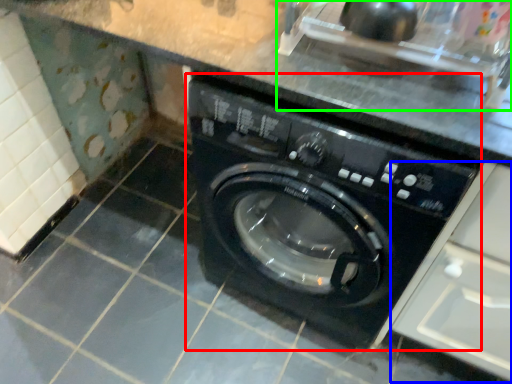
Question: Based on their relative distances, which object is farther from washing machine (highlighted by a red box)? Choose from drawer (highlighted by a blue box) and sink (highlighted by a green box).

Choices:
 (A) drawer
 (B) sink

Answer: (B)